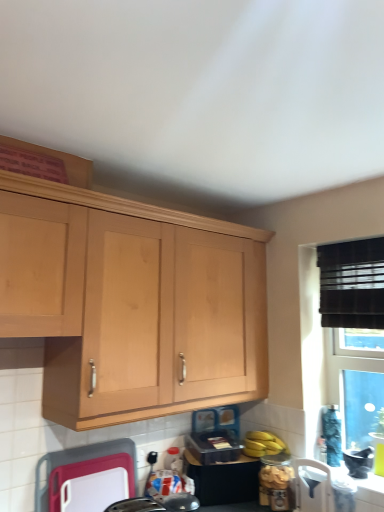
Question: Considering the positions of white plastic cutting board at lower center, arranged as the 3th appliance when viewed from the right, and yellow matte bananas at lower right in the image, is white plastic cutting board at lower center, arranged as the 3th appliance when viewed from the right, wider or thinner than yellow matte bananas at lower right?

Choices:
 (A) wide
 (B) thin

Answer: (B)

Question: Considering their positions, is white plastic cutting board at lower center, which is counted as the first appliance, starting from the left, located in front of or behind yellow matte bananas at lower right?

Choices:
 (A) behind
 (B) front

Answer: (B)

Question: Which is farther from the white plastic chair at lower right, marked as the 1th appliance in a right-to-left arrangement?

Choices:
 (A) translucent glass jar at lower right, the 2th appliance in the right-to-left sequence
 (B) yellow matte bananas at lower right
 (C) white plastic cutting board at lower center, which is counted as the first appliance, starting from the left
 (D) light wood cabinet at upper left

Answer: (C)

Question: Which is farther from the yellow matte bananas at lower right?

Choices:
 (A) white plastic chair at lower right, the 3th appliance positioned from the left
 (B) translucent glass jar at lower right, the 2th appliance in the left-to-right sequence
 (C) light wood cabinet at upper left
 (D) white plastic cutting board at lower center, arranged as the 3th appliance when viewed from the right

Answer: (C)